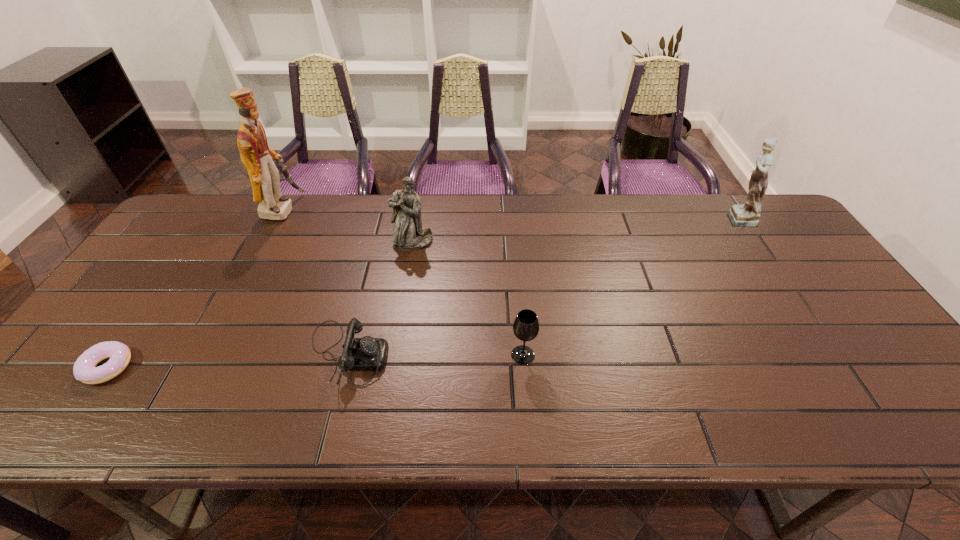
You are a GUI agent. You are given a task and a screenshot of the screen. Output one action in this format:
    pyautogui.click(x=<x>, y=<y>)
    Task: Click on the leftmost object
    The height and width of the screenshot is (540, 960).
    Given the screenshot: What is the action you would take?
    pyautogui.click(x=84, y=369)

This screenshot has width=960, height=540. Find the location of `vacant position located 0.080m on the front-facing side of the nutcracker`. vacant position located 0.080m on the front-facing side of the nutcracker is located at coordinates (323, 210).

Identify the location of free point located 0.110m on the front-facing side of the taller figurine. Image resolution: width=960 pixels, height=540 pixels. (684, 218).

This screenshot has height=540, width=960. I want to click on free spot located 0.050m on the front-facing side of the taller figurine, so click(703, 218).

At what (x,y) coordinates should I click in order to perform the action: click on vacant area located on the front-facing side of the taller figurine. Please return your answer as a coordinate pair (x, y). The image size is (960, 540). Looking at the image, I should click on (703, 218).

This screenshot has height=540, width=960. I want to click on free space located on the front-facing side of the nearer figurine, so click(x=405, y=287).

Locate an element on the screen. This screenshot has width=960, height=540. free location located 0.340m on the back of the second object from right to left is located at coordinates (515, 252).

Find the location of `vacant region located 0.200m on the front-facing side of the telephone`. vacant region located 0.200m on the front-facing side of the telephone is located at coordinates (472, 355).

This screenshot has width=960, height=540. I want to click on vacant space located 0.240m on the right of the doughnut, so click(234, 367).

Identify the location of nutcracker positioned at the far edge. (258, 158).